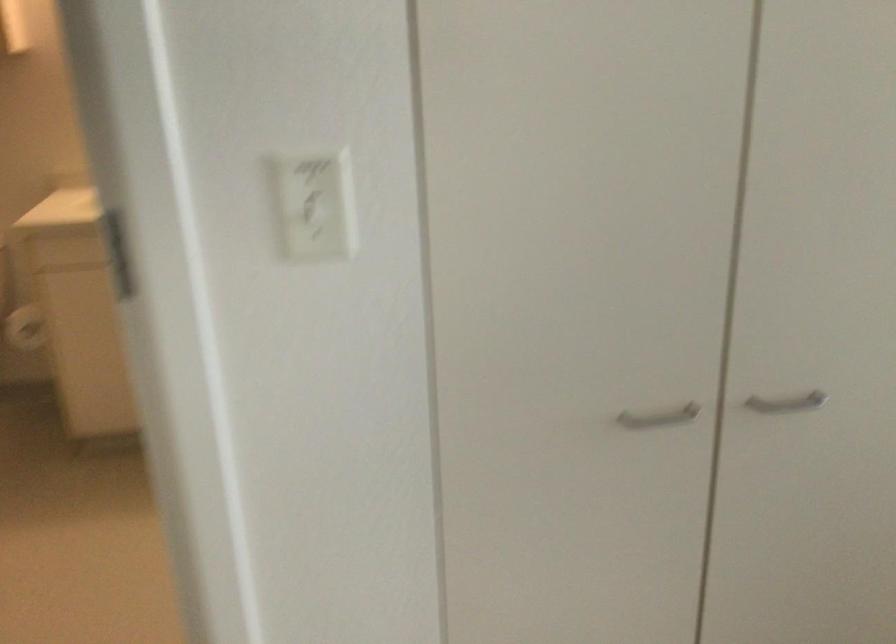
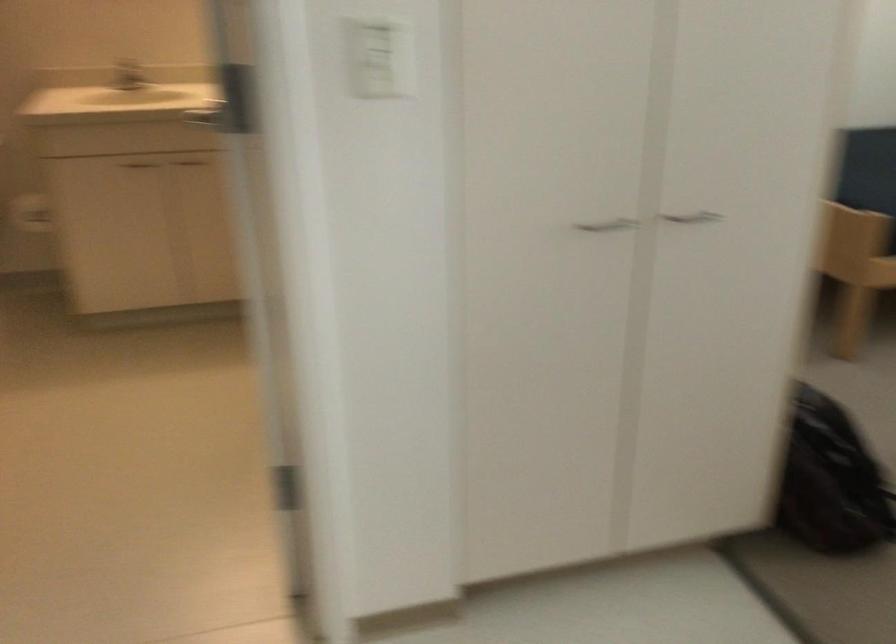
Question: Based on the continuous images, in which direction is the camera rotating? Reply with the corresponding letter.

Choices:
 (A) Left
 (B) Right
 (C) Up
 (D) Down

Answer: (B)